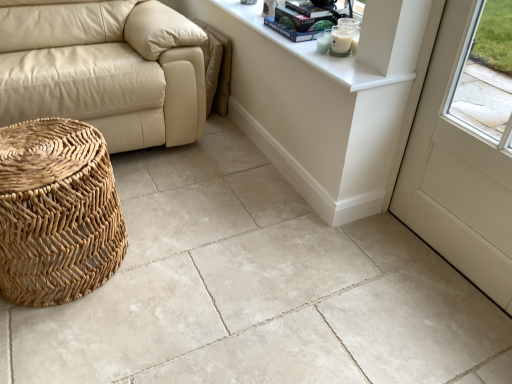
Question: Is white glossy counter top at upper right taller than white glossy table at upper center?

Choices:
 (A) no
 (B) yes

Answer: (A)

Question: Can you confirm if white glossy counter top at upper right is thinner than white glossy table at upper center?

Choices:
 (A) no
 (B) yes

Answer: (A)

Question: From a real-world perspective, is white glossy counter top at upper right over white glossy table at upper center?

Choices:
 (A) yes
 (B) no

Answer: (A)

Question: Could you tell me if white glossy counter top at upper right is facing white glossy table at upper center?

Choices:
 (A) yes
 (B) no

Answer: (B)

Question: From a real-world perspective, is white glossy counter top at upper right physically below white glossy table at upper center?

Choices:
 (A) no
 (B) yes

Answer: (A)

Question: Relative to white glossy table at upper center, is white matte screen door at lower right in front or behind?

Choices:
 (A) front
 (B) behind

Answer: (A)

Question: From the image's perspective, is white matte screen door at lower right positioned above or below white glossy table at upper center?

Choices:
 (A) below
 (B) above

Answer: (A)

Question: Is point (451, 21) positioned closer to the camera than point (406, 6)?

Choices:
 (A) farther
 (B) closer

Answer: (A)

Question: In the image, is white matte screen door at lower right on the left side or the right side of white glossy table at upper center?

Choices:
 (A) right
 (B) left

Answer: (A)

Question: Is point (456, 180) closer or farther from the camera than point (285, 9)?

Choices:
 (A) farther
 (B) closer

Answer: (B)

Question: From a real-world perspective, is white matte screen door at lower right physically located above or below hardcover book at upper center, the first book from the top?

Choices:
 (A) above
 (B) below

Answer: (B)

Question: Do you think white matte screen door at lower right is within hardcover book at upper center, the first book from the top, or outside of it?

Choices:
 (A) outside
 (B) inside

Answer: (A)

Question: From the image's perspective, relative to hardcover book at upper center, the first book from the top, is white matte screen door at lower right above or below?

Choices:
 (A) below
 (B) above

Answer: (A)

Question: From a real-world perspective, is beige leather couch at left physically located above or below hardcover book at upper center, positioned as the 2th book in top-to-bottom order?

Choices:
 (A) below
 (B) above

Answer: (A)

Question: Does point (49, 26) appear closer or farther from the camera than point (301, 34)?

Choices:
 (A) closer
 (B) farther

Answer: (B)